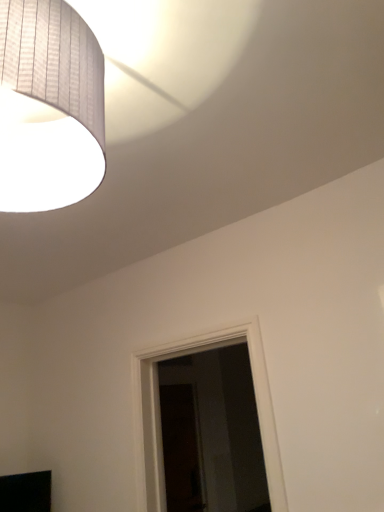
Find the location of a particular element. The width and height of the screenshot is (384, 512). white paper lampshade at upper left is located at coordinates (49, 106).

Describe the element at coordinates (49, 106) in the screenshot. Image resolution: width=384 pixels, height=512 pixels. I see `white paper lampshade at upper left` at that location.

Locate an element on the screen. This screenshot has width=384, height=512. black matte tv at lower left is located at coordinates (26, 492).

The width and height of the screenshot is (384, 512). What do you see at coordinates (26, 492) in the screenshot?
I see `black matte tv at lower left` at bounding box center [26, 492].

Locate an element on the screen. white paper lampshade at upper left is located at coordinates coord(49,106).

Considering the positions of objects black matte tv at lower left and white paper lampshade at upper left in the image provided, who is more to the right, black matte tv at lower left or white paper lampshade at upper left?

Positioned to the right is white paper lampshade at upper left.

Is black matte tv at lower left behind white paper lampshade at upper left?

Yes.

Which is less distant, (44, 474) or (74, 48)?

Point (74, 48)

From the image's perspective, would you say black matte tv at lower left is positioned over white paper lampshade at upper left?

Actually, black matte tv at lower left appears below white paper lampshade at upper left in the image.

Looking at this image, from a real-world perspective, which object stands above the other?

From a 3D spatial view, white paper lampshade at upper left is above.

Based on the photo, looking at their sizes, would you say black matte tv at lower left is wider or thinner than white paper lampshade at upper left?

black matte tv at lower left is thinner than white paper lampshade at upper left.

Is black matte tv at lower left taller than white paper lampshade at upper left?

No.

Can you confirm if black matte tv at lower left is smaller than white paper lampshade at upper left?

Correct, black matte tv at lower left occupies less space than white paper lampshade at upper left.

Is white paper lampshade at upper left a part of black matte tv at lower left?

That's incorrect, white paper lampshade at upper left is not inside black matte tv at lower left.

Is black matte tv at lower left not near white paper lampshade at upper left?

black matte tv at lower left is far away from white paper lampshade at upper left.

Could you tell me if black matte tv at lower left is facing white paper lampshade at upper left?

No.

How many degrees apart are the facing directions of black matte tv at lower left and white paper lampshade at upper left?

They differ by 123 degrees in their facing directions.

The width and height of the screenshot is (384, 512). I want to click on lamp located above the black matte tv at lower left (from a real-world perspective), so click(x=49, y=106).

Considering the relative positions of white paper lampshade at upper left and black matte tv at lower left in the image provided, is white paper lampshade at upper left to the right of black matte tv at lower left from the viewer's perspective?

Correct, you'll find white paper lampshade at upper left to the right of black matte tv at lower left.

Considering the relative positions of white paper lampshade at upper left and black matte tv at lower left in the image provided, is white paper lampshade at upper left behind black matte tv at lower left?

No.

Which is nearer, (65, 142) or (31, 473)?

Point (65, 142) appears to be closer to the viewer than point (31, 473).

From the image's perspective, relative to black matte tv at lower left, is white paper lampshade at upper left above or below?

From the image's perspective, white paper lampshade at upper left appears above black matte tv at lower left.

From a real-world perspective, is white paper lampshade at upper left located higher than black matte tv at lower left?

Indeed, from a real-world perspective, white paper lampshade at upper left stands above black matte tv at lower left.

Considering the relative sizes of white paper lampshade at upper left and black matte tv at lower left in the image provided, is white paper lampshade at upper left thinner than black matte tv at lower left?

Incorrect, the width of white paper lampshade at upper left is not less than that of black matte tv at lower left.

Between white paper lampshade at upper left and black matte tv at lower left, which one has more height?

white paper lampshade at upper left is taller.

Does white paper lampshade at upper left have a smaller size compared to black matte tv at lower left?

No, white paper lampshade at upper left is not smaller than black matte tv at lower left.

Would you say white paper lampshade at upper left contains black matte tv at lower left?

No, black matte tv at lower left is located outside of white paper lampshade at upper left.

Are white paper lampshade at upper left and black matte tv at lower left beside each other?

No, white paper lampshade at upper left is not making contact with black matte tv at lower left.

Based on the photo, is white paper lampshade at upper left facing towards black matte tv at lower left?

No.

How many degrees apart are the facing directions of white paper lampshade at upper left and black matte tv at lower left?

There is a 123-degree angle between the facing directions of white paper lampshade at upper left and black matte tv at lower left.

Identify the location of furniture below the white paper lampshade at upper left (from a real-world perspective). (26, 492).

Locate an element on the screen. The width and height of the screenshot is (384, 512). lamp located above the black matte tv at lower left (from the image's perspective) is located at coordinates (49, 106).

Image resolution: width=384 pixels, height=512 pixels. Identify the location of lamp in front of the black matte tv at lower left. (49, 106).